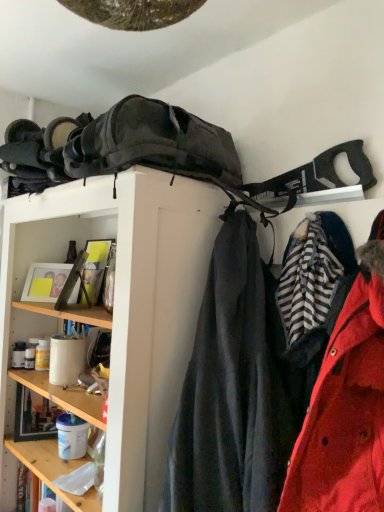
Question: From the image's perspective, is matte black backpack at upper center located above or below red matte coat at right?

Choices:
 (A) below
 (B) above

Answer: (A)

Question: Which is correct: matte black backpack at upper center is inside red matte coat at right, or outside of it?

Choices:
 (A) inside
 (B) outside

Answer: (B)

Question: Looking at their shapes, would you say matte black backpack at upper center is wider or thinner than red matte coat at right?

Choices:
 (A) wide
 (B) thin

Answer: (A)

Question: In terms of height, does red matte coat at right look taller or shorter compared to matte black backpack at upper center?

Choices:
 (A) tall
 (B) short

Answer: (B)

Question: In the image, is red matte coat at right positioned in front of or behind matte black backpack at upper center?

Choices:
 (A) front
 (B) behind

Answer: (B)

Question: Based on their sizes in the image, would you say red matte coat at right is bigger or smaller than matte black backpack at upper center?

Choices:
 (A) small
 (B) big

Answer: (A)

Question: Is red matte coat at right situated inside matte black backpack at upper center or outside?

Choices:
 (A) inside
 (B) outside

Answer: (A)